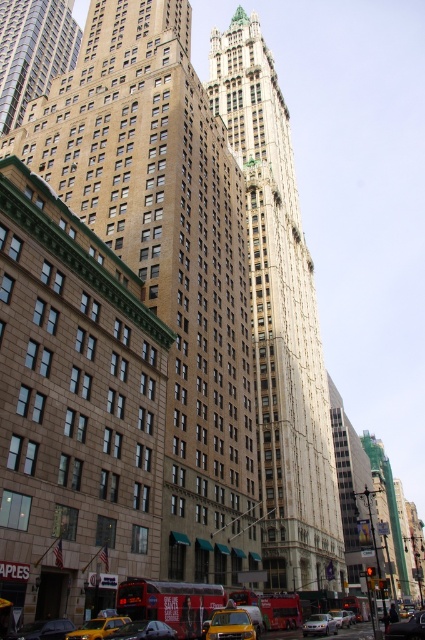
Does yellow matte taxi at lower center appear on the right side of yellow rubber car at lower center?

In fact, yellow matte taxi at lower center is to the left of yellow rubber car at lower center.

Between point (224, 616) and point (340, 621), which one is positioned in front?

Point (224, 616) is in front.

This screenshot has height=640, width=425. I want to click on yellow matte taxi at lower center, so click(229, 624).

At what (x,y) coordinates should I click in order to perform the action: click on yellow matte taxi at lower center. Please return your answer as a coordinate pair (x, y). Looking at the image, I should click on (229, 624).

Which of these two, brown stone building at center or yellow matte taxi at lower center, stands shorter?

With less height is yellow matte taxi at lower center.

Which is above, brown stone building at center or yellow matte taxi at lower center?

brown stone building at center is above.

Is point (244, 291) in front of point (240, 637)?

No, it is behind (240, 637).

At what (x,y) coordinates should I click in order to perform the action: click on brown stone building at center. Please return your answer as a coordinate pair (x, y). Looking at the image, I should click on (166, 257).

How far apart are white stone tower at center and silver metallic sedan at center?

The distance of white stone tower at center from silver metallic sedan at center is 60.07 meters.

Is the position of white stone tower at center more distant than that of silver metallic sedan at center?

That is True.

The height and width of the screenshot is (640, 425). Identify the location of white stone tower at center. (280, 323).

Where is `white stone tower at center`? This screenshot has height=640, width=425. white stone tower at center is located at coordinates (280, 323).